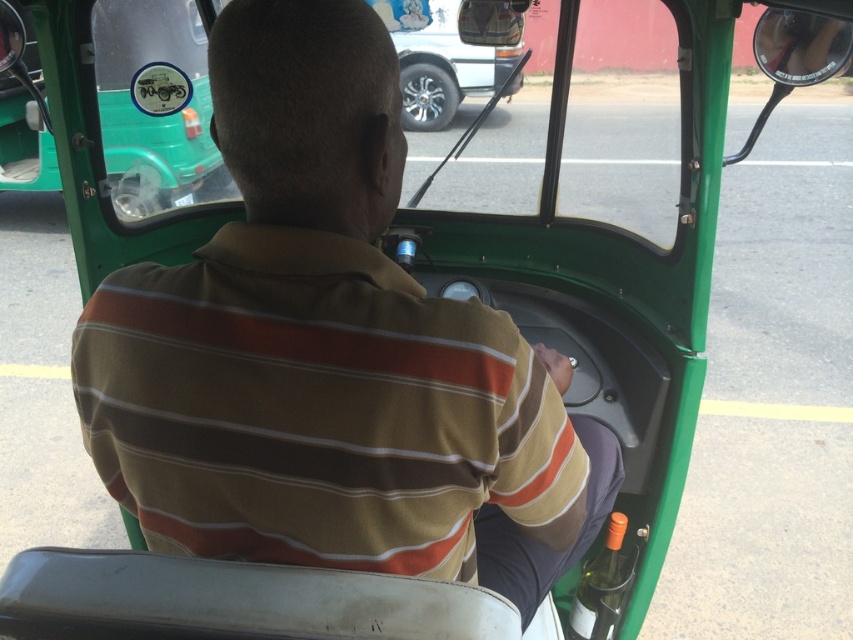
Question: Among these objects, which one is nearest to the camera?

Choices:
 (A) brown striped shirt at center
 (B) green matte car at upper center
 (C) orange matte bottle at lower right

Answer: (A)

Question: Does green matte car at upper center come in front of orange matte bottle at lower right?

Choices:
 (A) yes
 (B) no

Answer: (B)

Question: Which of these objects is positioned closest to the green matte car at upper center?

Choices:
 (A) orange matte bottle at lower right
 (B) brown striped shirt at center

Answer: (A)

Question: Does green matte car at upper center appear over orange matte bottle at lower right?

Choices:
 (A) no
 (B) yes

Answer: (B)

Question: Which point appears farthest from the camera in this image?

Choices:
 (A) (193, 38)
 (B) (585, 582)

Answer: (A)

Question: Does green matte car at upper center appear over orange matte bottle at lower right?

Choices:
 (A) yes
 (B) no

Answer: (A)